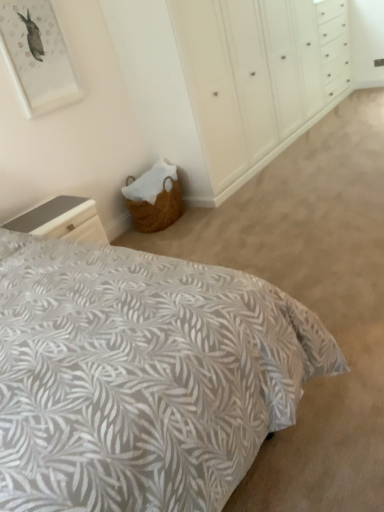
Question: In the image, is leaf-patterned fabric bed at lower left positioned in front of or behind woven basket at lower left?

Choices:
 (A) front
 (B) behind

Answer: (A)

Question: From a real-world perspective, is leaf-patterned fabric bed at lower left physically located above or below woven basket at lower left?

Choices:
 (A) above
 (B) below

Answer: (B)

Question: Which is nearer to the leaf-patterned fabric bed at lower left?

Choices:
 (A) woven basket at lower left
 (B) smooth gray nightstand at lower left
 (C) matte white picture frame at upper left

Answer: (B)

Question: Which object is positioned farthest from the leaf-patterned fabric bed at lower left?

Choices:
 (A) smooth gray nightstand at lower left
 (B) woven basket at lower left
 (C) matte white picture frame at upper left

Answer: (B)